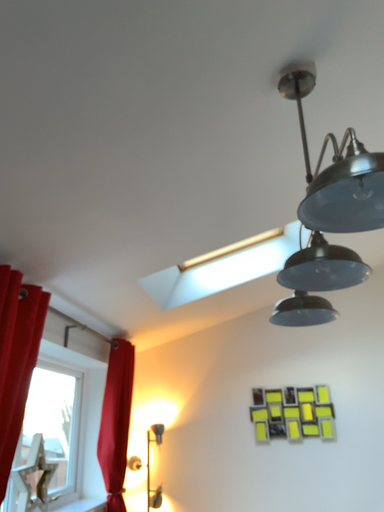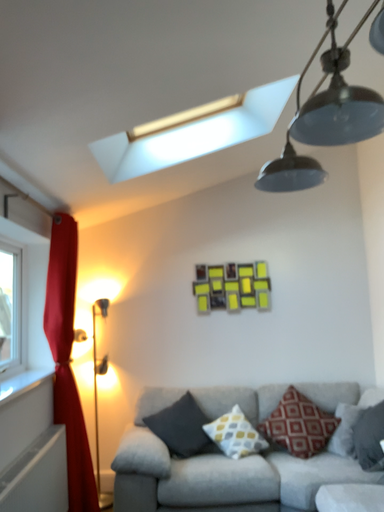
Question: How did the camera likely rotate when shooting the video?

Choices:
 (A) rotated downward
 (B) rotated upward

Answer: (A)